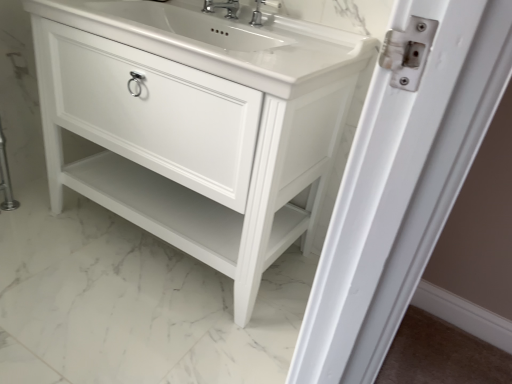
Identify the location of free spot in front of polished chrome faucet at upper center, which is the 1th tap from right to left. (281, 39).